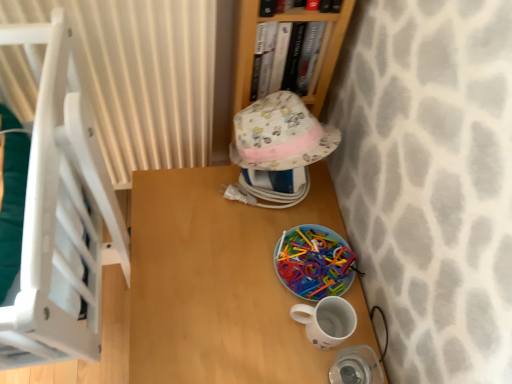
Question: Can you confirm if fluffy cotton hat at center is smaller than wooden bookshelf at upper center?

Choices:
 (A) yes
 (B) no

Answer: (B)

Question: Is fluffy cotton hat at center at the left side of wooden bookshelf at upper center?

Choices:
 (A) no
 (B) yes

Answer: (B)

Question: Would you say fluffy cotton hat at center is a long distance from wooden bookshelf at upper center?

Choices:
 (A) yes
 (B) no

Answer: (B)

Question: Is fluffy cotton hat at center shorter than wooden bookshelf at upper center?

Choices:
 (A) yes
 (B) no

Answer: (B)

Question: Is fluffy cotton hat at center not within wooden bookshelf at upper center?

Choices:
 (A) yes
 (B) no

Answer: (A)

Question: Is beige striped curtain at upper left inside or outside of hardcover book at upper center?

Choices:
 (A) outside
 (B) inside

Answer: (A)

Question: From a real-world perspective, is beige striped curtain at upper left physically located above or below hardcover book at upper center?

Choices:
 (A) above
 (B) below

Answer: (B)

Question: Looking at the image, does beige striped curtain at upper left seem bigger or smaller compared to hardcover book at upper center?

Choices:
 (A) big
 (B) small

Answer: (A)

Question: From the image's perspective, relative to hardcover book at upper center, is beige striped curtain at upper left above or below?

Choices:
 (A) below
 (B) above

Answer: (A)

Question: Does point (218, 347) appear closer or farther from the camera than point (248, 125)?

Choices:
 (A) farther
 (B) closer

Answer: (B)

Question: Is wooden table at center in front of or behind fluffy cotton hat at center in the image?

Choices:
 (A) behind
 (B) front

Answer: (B)

Question: From the image's perspective, relative to fluffy cotton hat at center, is wooden table at center above or below?

Choices:
 (A) above
 (B) below

Answer: (B)

Question: From a real-world perspective, is wooden table at center physically located above or below fluffy cotton hat at center?

Choices:
 (A) below
 (B) above

Answer: (A)

Question: In the image, is wooden bookshelf at upper center on the left side or the right side of fluffy cotton hat at center?

Choices:
 (A) right
 (B) left

Answer: (A)

Question: From the image's perspective, is wooden bookshelf at upper center positioned above or below fluffy cotton hat at center?

Choices:
 (A) below
 (B) above

Answer: (B)